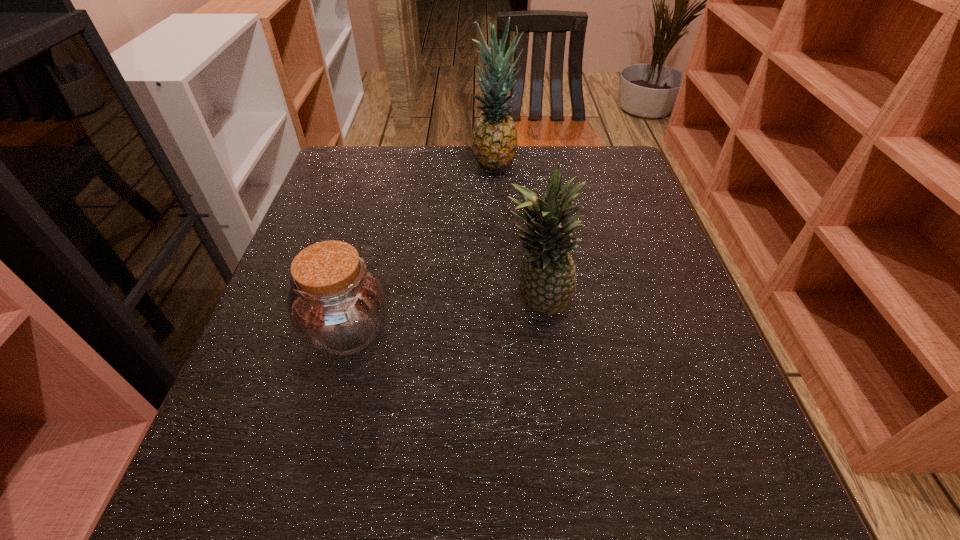
Locate an element on the screen. The height and width of the screenshot is (540, 960). object that is at the left edge is located at coordinates (337, 304).

Image resolution: width=960 pixels, height=540 pixels. What are the coordinates of `free space at the far edge of the desktop` in the screenshot? It's located at (566, 174).

The image size is (960, 540). Find the location of `free space at the near edge`. free space at the near edge is located at coordinates (362, 463).

Identify the location of vacant space at the left edge. The image size is (960, 540). (300, 237).

Find the location of a particular element. The image size is (960, 540). blank space at the right edge of the desktop is located at coordinates (623, 251).

At what (x,y) coordinates should I click in order to perform the action: click on vacant position at the far left corner of the desktop. Please return your answer as a coordinate pair (x, y). Looking at the image, I should click on (366, 146).

Find the location of a particular element. vacant position at the near left corner of the desktop is located at coordinates (245, 520).

The height and width of the screenshot is (540, 960). In order to click on vacant space at the far right corner of the desktop in this screenshot , I will do `click(636, 194)`.

Locate an element on the screen. The width and height of the screenshot is (960, 540). vacant space at the near right corner of the desktop is located at coordinates (729, 493).

Identify the location of free point between the jar and the second shortest object. (443, 317).